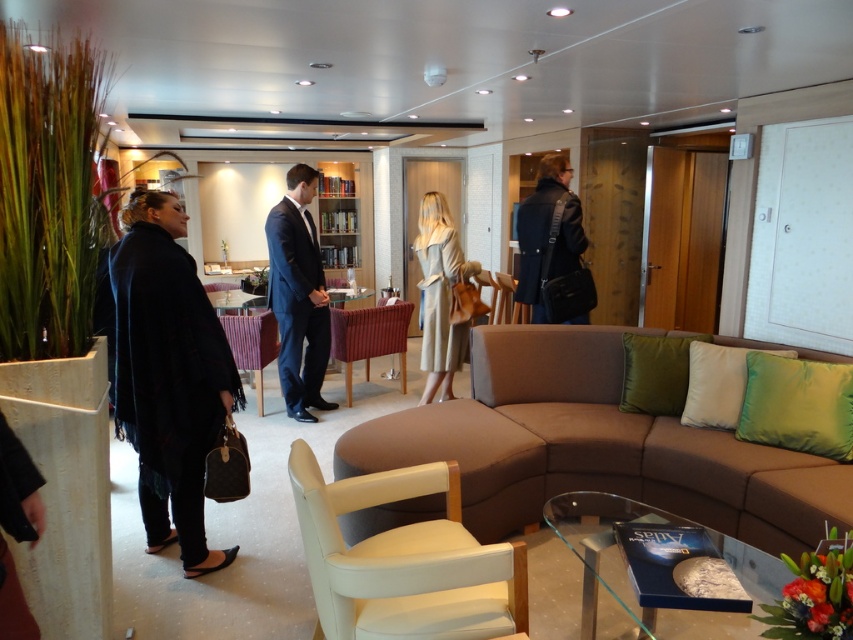
You are organizing a coat rack and have both the dark blue woolen shawl at left and the dark blue leather jacket at center. If you want to hang them side by side, which item should you place on the left to ensure they both fit without overlapping?

The dark blue woolen shawl at left might be wider than the dark blue leather jacket at center, so placing the shawl on the left would allow both items to fit side by side without overlapping since it occupies more horizontal space.

You are sitting on the velvet burgundy armchair at center and want to reach the coffee table in front of the brown fabric couch at center. Which direction should you move to get to the coffee table?

The brown fabric couch at center is to the right of the velvet burgundy armchair at center, so you should move to your right to reach the coffee table in front of the brown fabric couch at center.

You are a guest in this lounge and want to sit down. You see the brown fabric couch at center and the velvet burgundy armchair at center. Which one is located above the other?

The velvet burgundy armchair at center is above the brown fabric couch at center because the brown fabric couch at center is positioned under it.